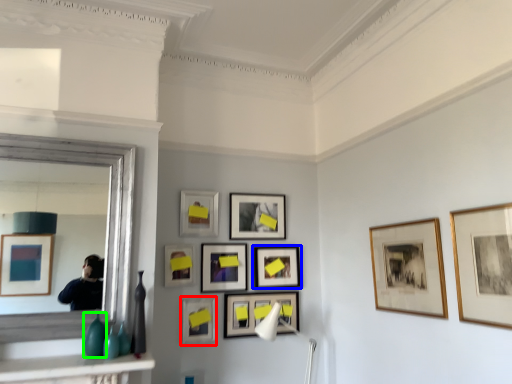
Question: Estimate the real-world distances between objects in this image. Which object is closer to picture frame (highlighted by a red box), picture frame (highlighted by a blue box) or glass vase (highlighted by a green box)?

Choices:
 (A) picture frame
 (B) glass vase

Answer: (A)